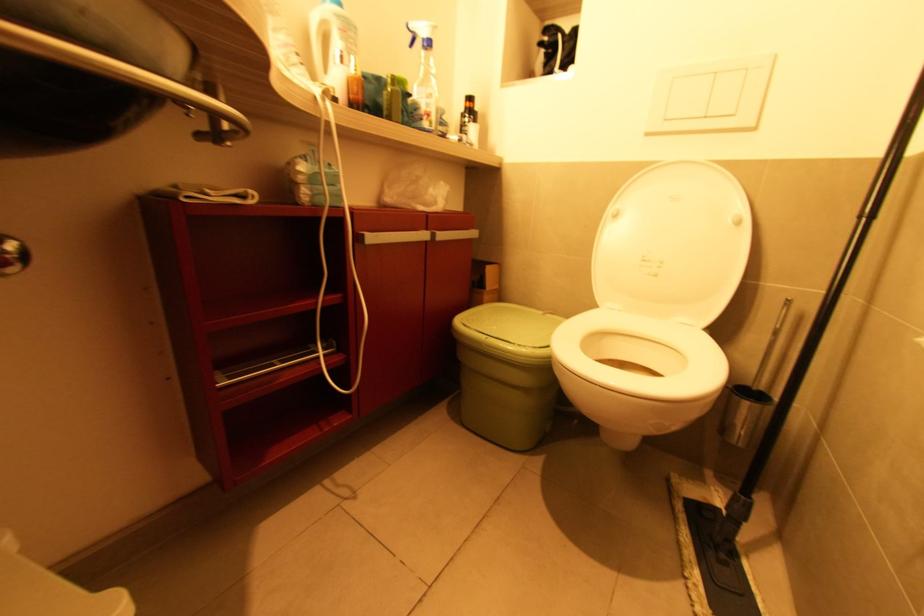
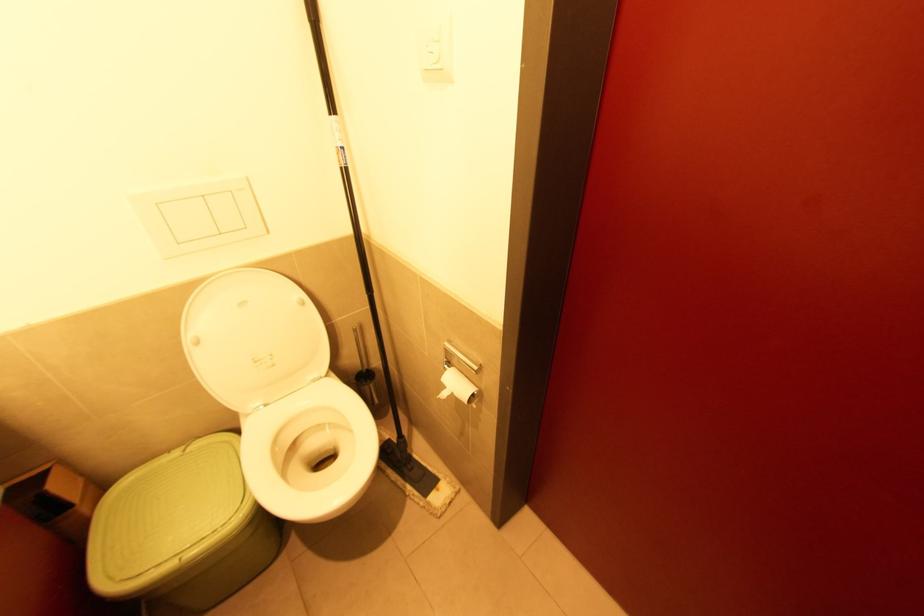
Where in the second image is the point corresponding to point (742, 383) from the first image?

(358, 374)